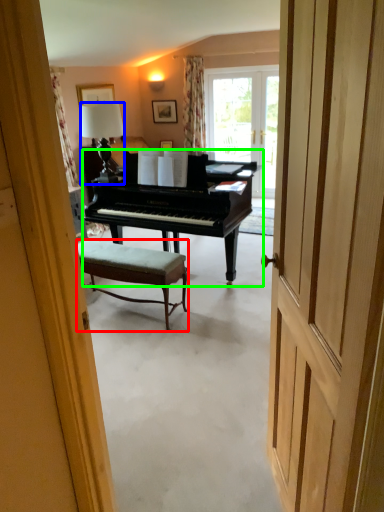
Question: Which object is positioned farthest from stool (highlighted by a red box)? Select from lamp (highlighted by a blue box) and piano (highlighted by a green box).

Choices:
 (A) lamp
 (B) piano

Answer: (A)